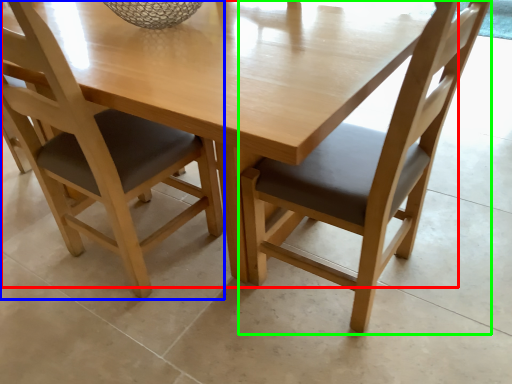
Question: Estimate the real-world distances between objects in this image. Which object is closer to round table (highlighted by a red box), chair (highlighted by a blue box) or chair (highlighted by a green box)?

Choices:
 (A) chair
 (B) chair

Answer: (B)